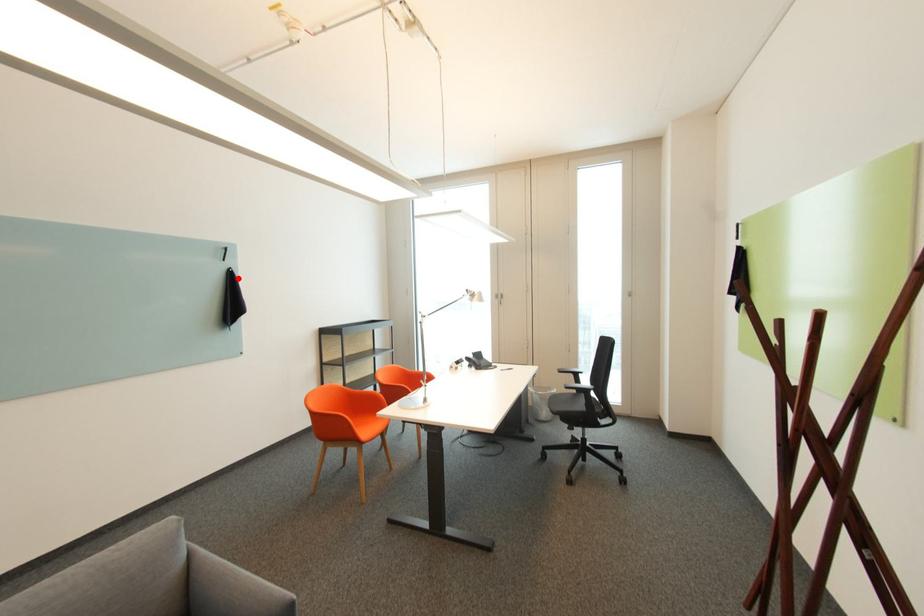
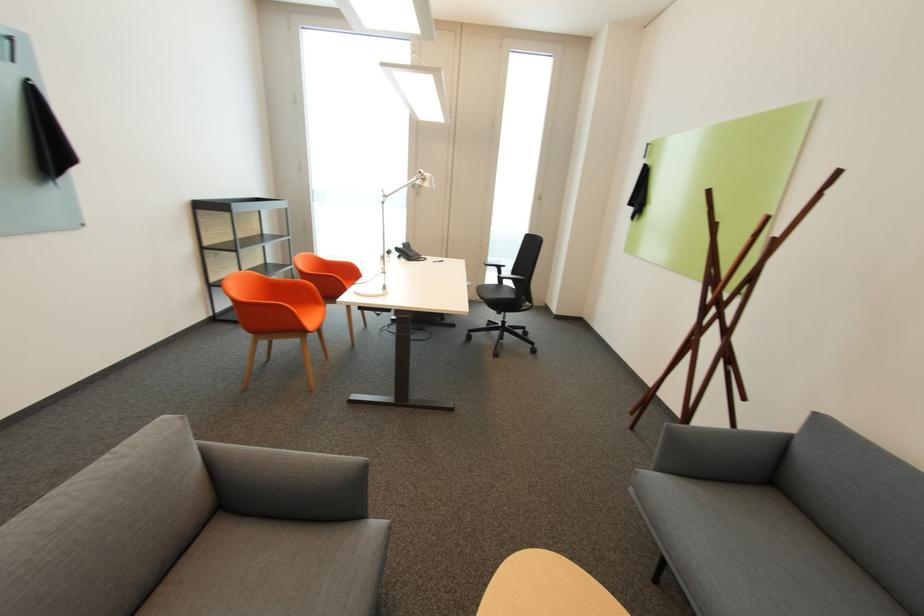
Where in the second image is the point corresponding to the highlighted location from the first image?

(43, 99)